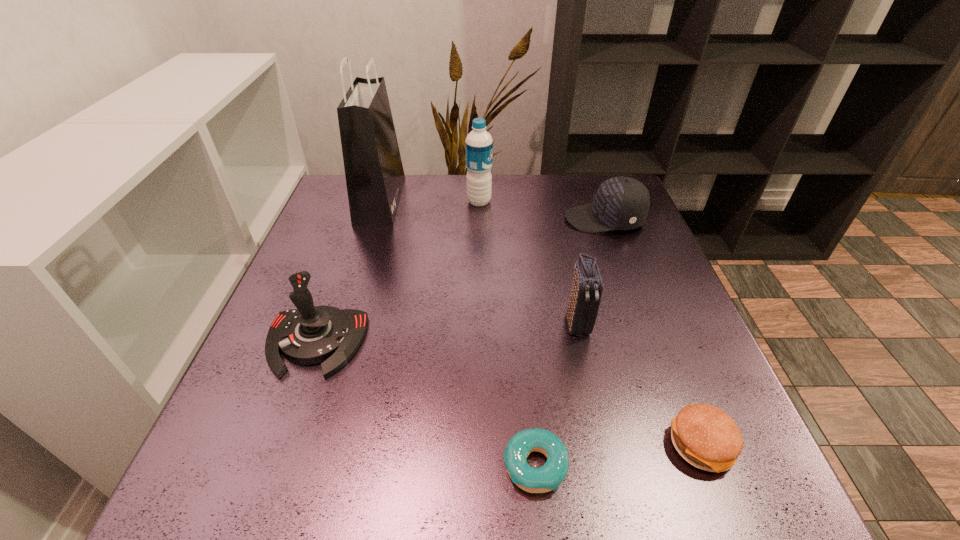
This screenshot has height=540, width=960. I want to click on vacant space located on the label of the water bottle, so click(x=596, y=201).

You are a GUI agent. You are given a task and a screenshot of the screen. Output one action in this format:
    pyautogui.click(x=<x>, y=<y>)
    Task: Click on the vacant space located with the zip open on the fifth object from left to right
    
    Given the screenshot: What is the action you would take?
    pyautogui.click(x=603, y=438)

At what (x,y) coordinates should I click in order to perform the action: click on vacant space located on the handle side of the joystick. Please return your answer as a coordinate pair (x, y). This screenshot has height=540, width=960. Looking at the image, I should click on (261, 495).

This screenshot has height=540, width=960. I want to click on free space located 0.110m at the front of the third shortest object where the brim is located, so click(523, 219).

Identify the location of vacant space located 0.050m at the front of the third shortest object where the brim is located. The image size is (960, 540). (546, 219).

This screenshot has height=540, width=960. I want to click on vacant space located at the front of the third shortest object where the brim is located, so click(x=436, y=219).

Where is `blank space located 0.270m on the left of the hamburger`? blank space located 0.270m on the left of the hamburger is located at coordinates (500, 446).

Image resolution: width=960 pixels, height=540 pixels. What are the coordinates of `free space located 0.250m on the right of the fourth object from left to right` in the screenshot? It's located at (730, 465).

This screenshot has height=540, width=960. I want to click on shopping bag positioned at the far edge, so click(x=374, y=173).

Where is `water bottle positioned at the far edge`? The height and width of the screenshot is (540, 960). water bottle positioned at the far edge is located at coordinates (479, 145).